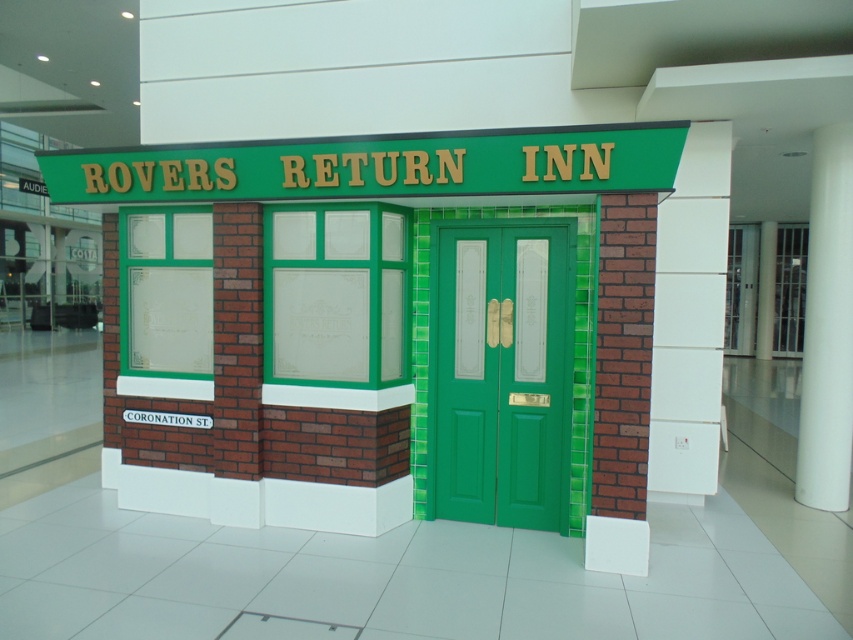
You are a delivery person trying to enter the Rovers Return Inn miniature model. The entrance is through the green painted wood door at center. However, you notice a white smooth pillar at right nearby. Considering their sizes, will the door be wide enough for you to pass through comfortably?

The green painted wood door at center is smaller than the white smooth pillar at right. Since the door is smaller, it might not be wide enough for comfortable passage. Compare its size to the pillar to assess suitability.

You are a delivery person trying to deliver a package to the green painted wood door at center of the Rovers Return Inn model. However, there is a green painted wood sign at upper center blocking your path. Can you fit the package through the space between the door and the sign?

The green painted wood door at center is taller than the green painted wood sign at upper center, so there is enough vertical space between them for the package to fit through.